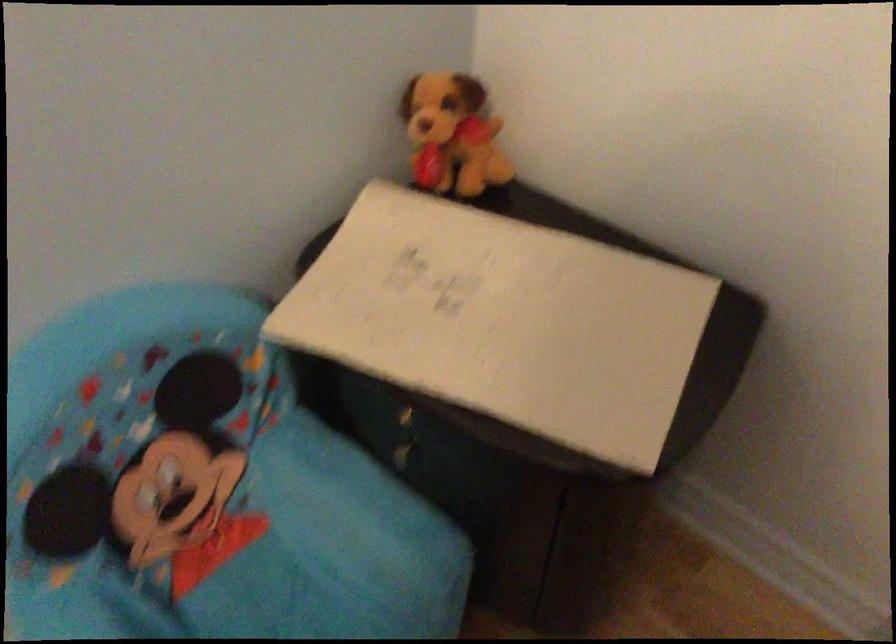
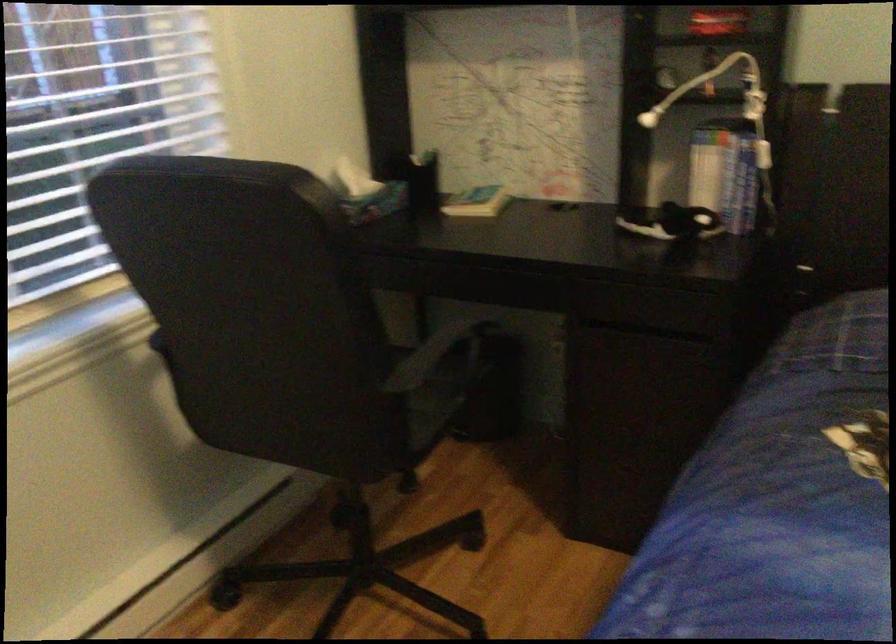
The images are taken continuously from a first-person perspective. In which direction is your viewpoint rotating?

The camera rotated toward right-down.